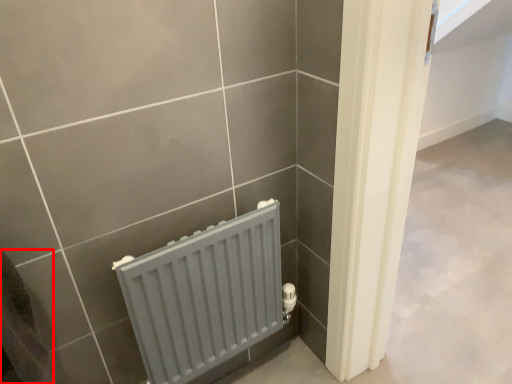
Question: From the image's perspective, considering the relative positions of gray (annotated by the red box) and radiator in the image provided, where is gray (annotated by the red box) located with respect to the staircase?

Choices:
 (A) below
 (B) above

Answer: (B)